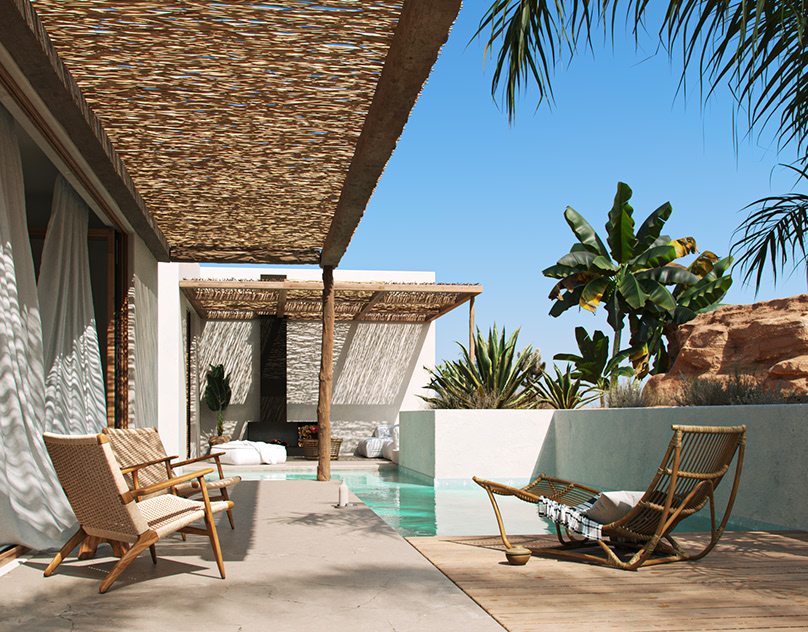
You are a GUI agent. You are given a task and a screenshot of the screen. Output one action in this format:
    pyautogui.click(x=<x>, y=<y>)
    Task: Click on the flooring to the right
    The height and width of the screenshot is (632, 808).
    Given the screenshot: What is the action you would take?
    pyautogui.click(x=600, y=610)